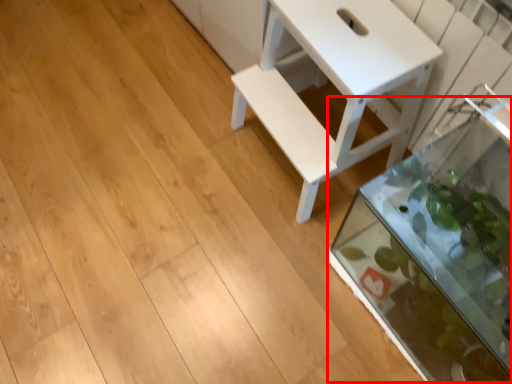
Question: From the image's perspective, what is the correct spatial relationship of glass box (annotated by the red box) in relation to table?

Choices:
 (A) below
 (B) above

Answer: (A)